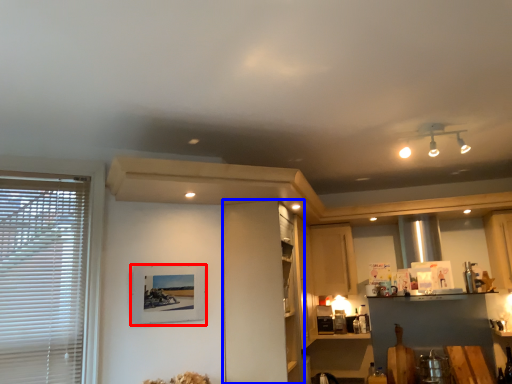
Question: Which point is closer to the camera, picture frame (highlighted by a red box) or cabinetry (highlighted by a blue box)?

Choices:
 (A) picture frame
 (B) cabinetry

Answer: (A)